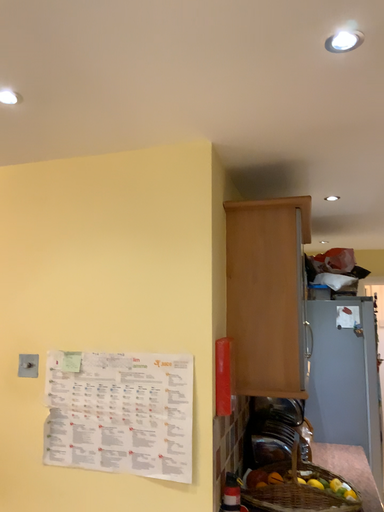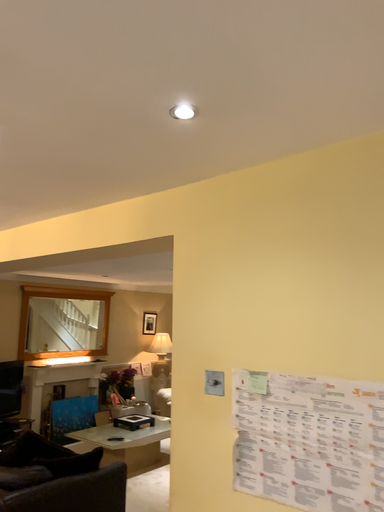
Question: How did the camera likely rotate when shooting the video?

Choices:
 (A) rotated left
 (B) rotated right

Answer: (A)